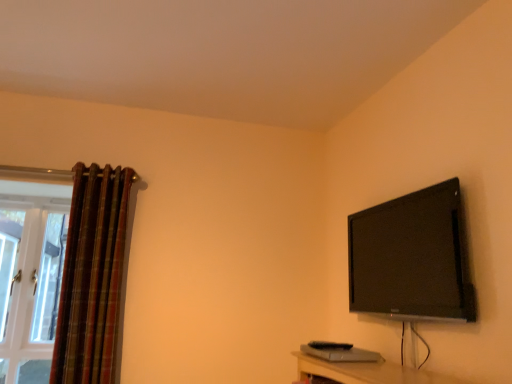
Question: Is black glossy tv at upper right outside white glass door at left?

Choices:
 (A) no
 (B) yes

Answer: (B)

Question: Can you confirm if black glossy tv at upper right is shorter than white glass door at left?

Choices:
 (A) no
 (B) yes

Answer: (B)

Question: Is black glossy tv at upper right positioned in front of white glass door at left?

Choices:
 (A) yes
 (B) no

Answer: (A)

Question: Is white glass door at left surrounded by black glossy tv at upper right?

Choices:
 (A) no
 (B) yes

Answer: (A)

Question: Can you confirm if black glossy tv at upper right is taller than white glass door at left?

Choices:
 (A) no
 (B) yes

Answer: (A)

Question: Looking at their shapes, would you say black glossy tv at upper right is wider or thinner than white glass door at left?

Choices:
 (A) wide
 (B) thin

Answer: (A)

Question: Does point (419, 274) appear closer or farther from the camera than point (49, 314)?

Choices:
 (A) farther
 (B) closer

Answer: (B)

Question: From the image's perspective, relative to white glass door at left, is black glossy tv at upper right above or below?

Choices:
 (A) below
 (B) above

Answer: (B)

Question: Visually, is black glossy tv at upper right positioned to the left or to the right of white glass door at left?

Choices:
 (A) left
 (B) right

Answer: (B)

Question: In terms of height, does white glass door at left look taller or shorter compared to black glossy tv at upper right?

Choices:
 (A) tall
 (B) short

Answer: (A)

Question: Based on their positions, is white glass door at left located to the left or right of black glossy tv at upper right?

Choices:
 (A) right
 (B) left

Answer: (B)

Question: From the image's perspective, relative to black glossy tv at upper right, is white glass door at left above or below?

Choices:
 (A) below
 (B) above

Answer: (A)

Question: Considering the positions of white glass door at left and black glossy tv at upper right in the image, is white glass door at left bigger or smaller than black glossy tv at upper right?

Choices:
 (A) small
 (B) big

Answer: (A)

Question: In the image, is white glass door at left positioned in front of or behind plaid fabric curtain at left?

Choices:
 (A) front
 (B) behind

Answer: (B)

Question: From their relative heights in the image, would you say white glass door at left is taller or shorter than plaid fabric curtain at left?

Choices:
 (A) short
 (B) tall

Answer: (A)